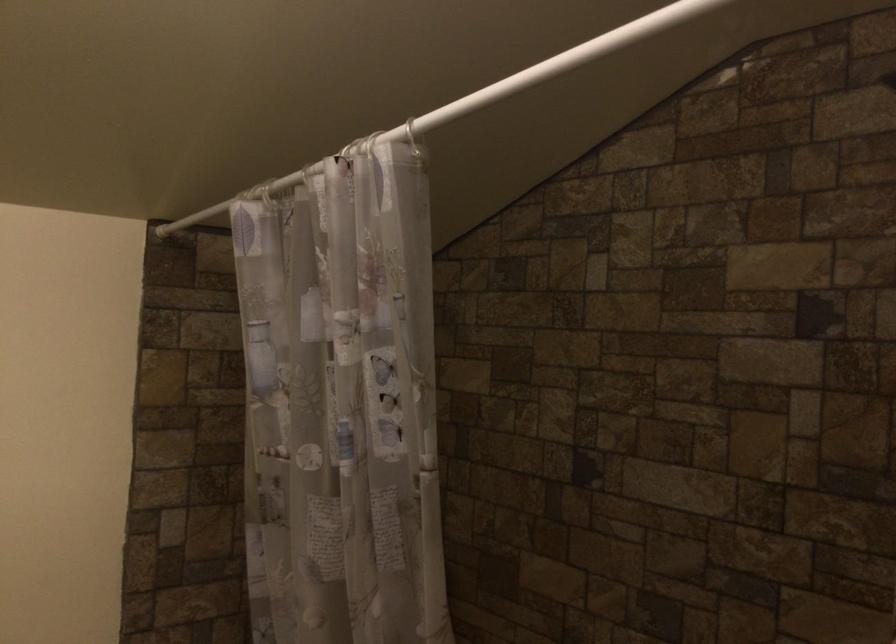
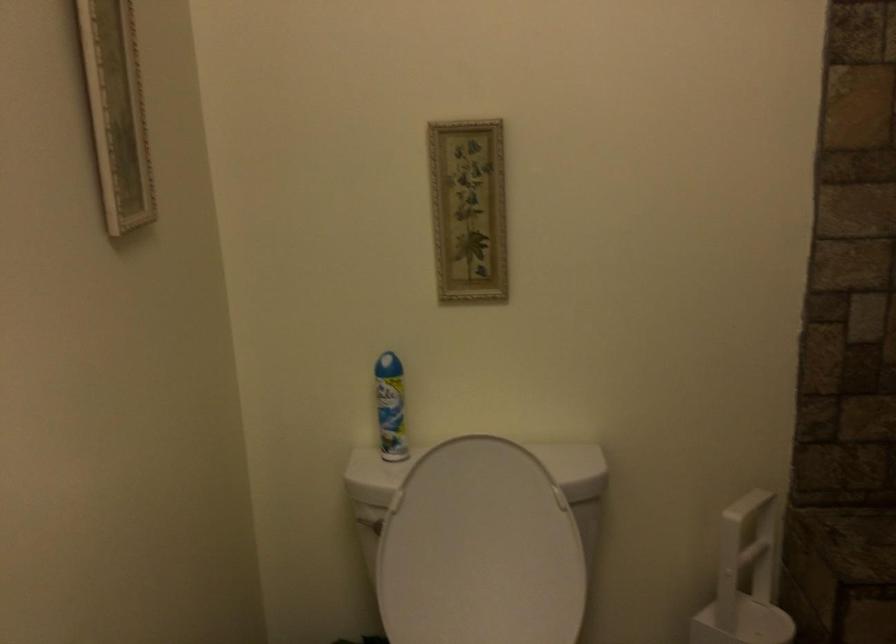
Question: How did the camera likely rotate?

Choices:
 (A) Left
 (B) Right
 (C) Up
 (D) Down

Answer: (A)